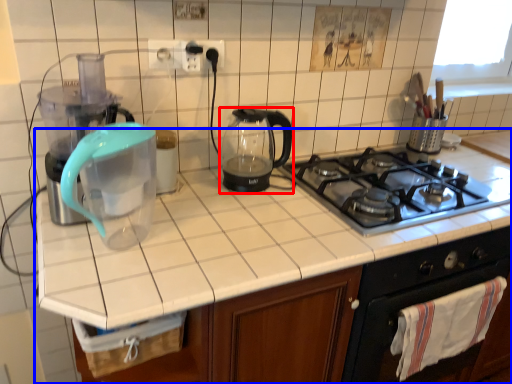
Question: Which point is closer to the camera, kitchen appliance (highlighted by a red box) or countertop (highlighted by a blue box)?

Choices:
 (A) kitchen appliance
 (B) countertop

Answer: (B)